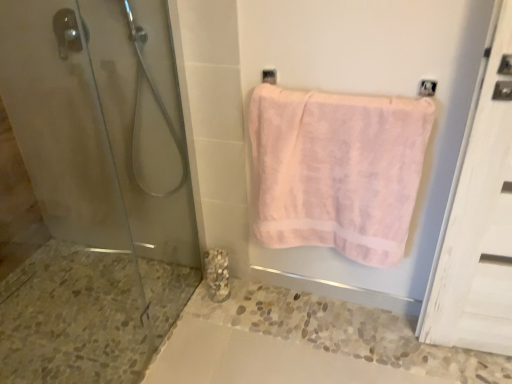
Identify the location of vacant space that is to the left of marble textured at lower left. This screenshot has height=384, width=512. (183, 297).